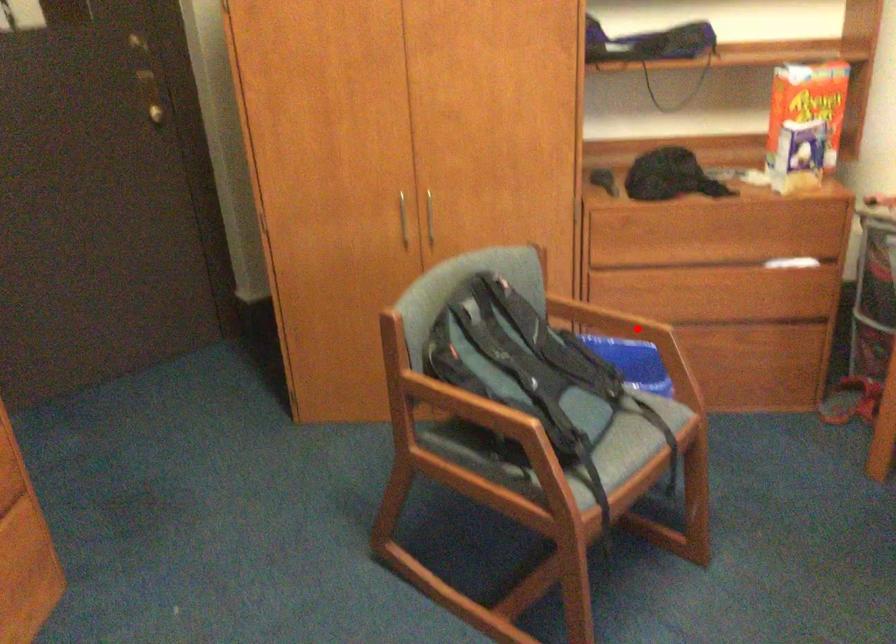
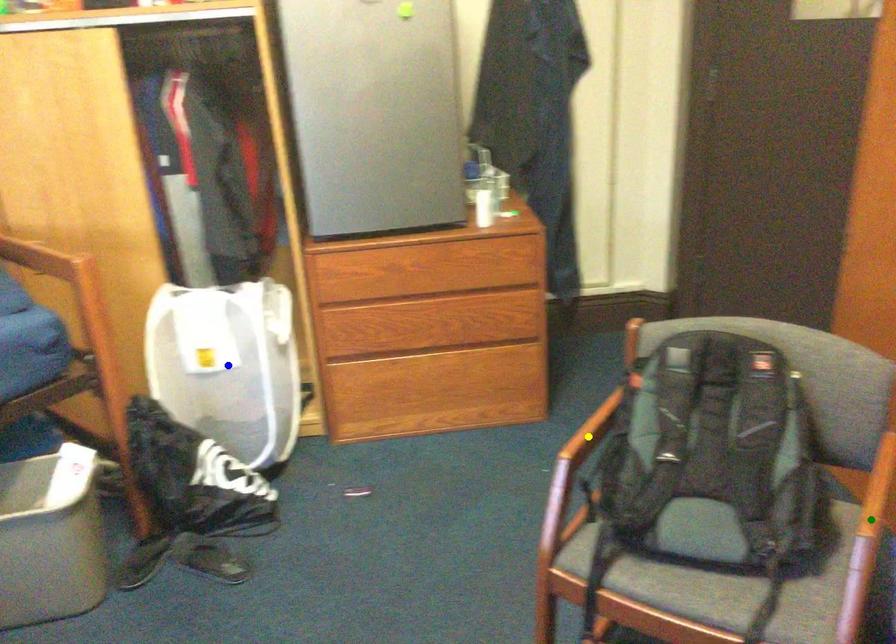
Question: I am providing you with two images of the same scene from different viewpoints. A red point is marked on the first image. You are given multiple points on the second image. Which mark in image 2 goes with the point in image 1?

Choices:
 (A) blue point
 (B) yellow point
 (C) green point

Answer: (C)